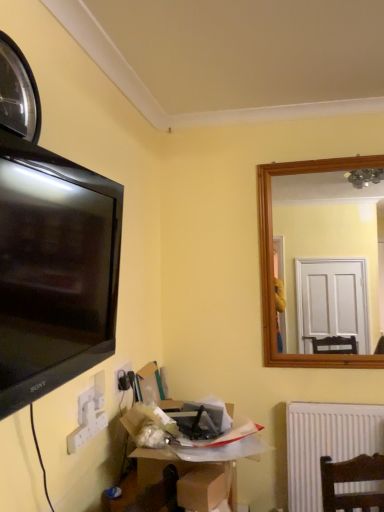
Question: Does point (155, 465) appear closer or farther from the camera than point (26, 154)?

Choices:
 (A) farther
 (B) closer

Answer: (A)

Question: From the image's perspective, is cardboard box at lower center, which appears as the 1th cardboard box when viewed from the back, positioned above or below matte black tv at left?

Choices:
 (A) above
 (B) below

Answer: (B)

Question: Which of these objects is positioned farthest from the metallic reflective clock at upper left?

Choices:
 (A) brown cardboard box at lower center, the first cardboard box positioned from the front
 (B) cardboard box at lower center, the second cardboard box from the front
 (C) white ribbed radiator at lower right
 (D) white plastic electric outlet at lower left
 (E) matte black tv at left

Answer: (C)

Question: Based on their relative distances, which object is farther from the cardboard box at lower center, which appears as the 1th cardboard box when viewed from the back?

Choices:
 (A) white plastic electric outlet at lower left
 (B) metallic reflective clock at upper left
 (C) brown cardboard box at lower center, which is the second cardboard box in back-to-front order
 (D) matte black tv at left
 (E) white ribbed radiator at lower right

Answer: (B)